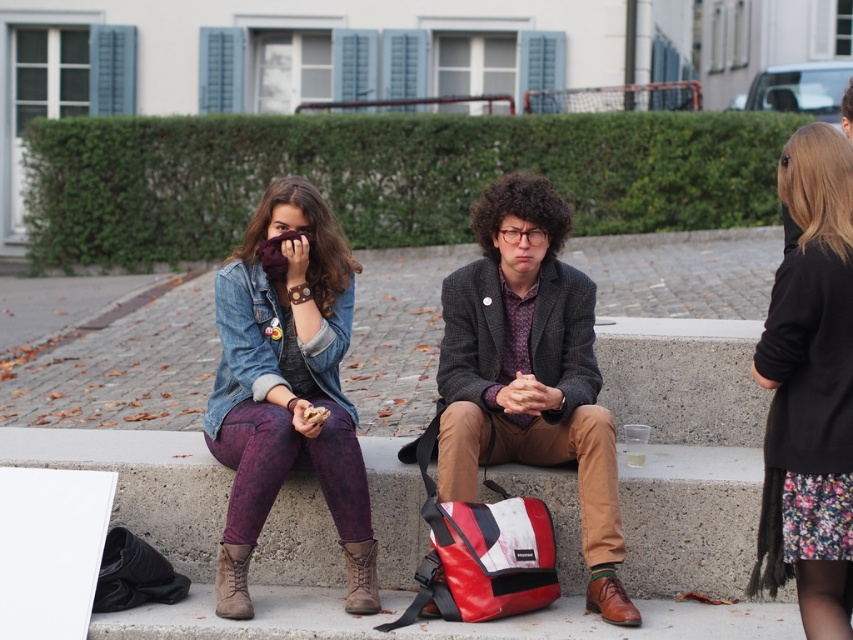
From the picture: Looking at the scene, there are two items of clothing visible. The floral dress at right and the brown leather boot at lower center. Which one is positioned higher in the image?

The floral dress at right is above the brown leather boot at lower center, so it is positioned higher in the image.

You are standing in the public space and want to place a small potted plant between the woman on the left and the textured wool blazer at center. Based on their positions, where should you position the plant?

The plant should be placed between the woman on the left and the textured wool blazer at center, centered at point (529,371) as per the coordinates provided for the blazer.

You are a photographer standing in front of the scene. You want to take a photo of the textured wool blazer at center and the brown leather boot at lower left. Which object will appear closer to the camera in the photo?

The textured wool blazer at center will appear closer to the camera in the photo because it is further to the viewer than the brown leather boot at lower left, meaning it is positioned nearer to the photographer.